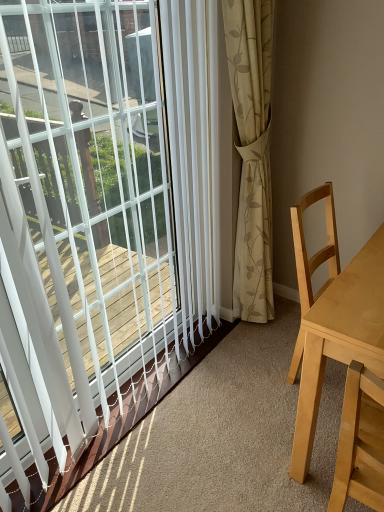
This screenshot has width=384, height=512. What do you see at coordinates (340, 339) in the screenshot?
I see `light wood table at right` at bounding box center [340, 339].

At what (x,y) coordinates should I click in order to perform the action: click on light wood table at right. Please return your answer as a coordinate pair (x, y). Looking at the image, I should click on (340, 339).

Describe the element at coordinates (101, 207) in the screenshot. I see `white plastic blinds at upper left` at that location.

This screenshot has width=384, height=512. Identify the location of white plastic blinds at upper left. (101, 207).

In order to face white plastic blinds at upper left, should I rotate leftwards or rightwards?

Rotate your view left by about 10.542°.

At what (x,y) coordinates should I click in order to perform the action: click on light wood table at right. Please return your answer as a coordinate pair (x, y). The height and width of the screenshot is (512, 384). Looking at the image, I should click on (340, 339).

Is light wood table at right to the left or to the right of white plastic blinds at upper left in the image?

From the image, it's evident that light wood table at right is to the right of white plastic blinds at upper left.

In the image, is light wood table at right positioned in front of or behind white plastic blinds at upper left?

Clearly, light wood table at right is behind white plastic blinds at upper left.

Which is behind, point (299, 393) or point (92, 322)?

Positioned behind is point (92, 322).

From the image's perspective, is light wood table at right below white plastic blinds at upper left?

Yes.

From a real-world perspective, is light wood table at right above or below white plastic blinds at upper left?

light wood table at right is situated lower than white plastic blinds at upper left in the real world.

Which object is wider, light wood table at right or white plastic blinds at upper left?

With larger width is light wood table at right.

From their relative heights in the image, would you say light wood table at right is taller or shorter than white plastic blinds at upper left?

Considering their sizes, light wood table at right has less height than white plastic blinds at upper left.

In the scene shown: Who is bigger, light wood table at right or white plastic blinds at upper left?

light wood table at right is bigger.

Would you say light wood table at right is inside or outside white plastic blinds at upper left?

The correct answer is: outside.

Is light wood table at right with white plastic blinds at upper left?

No, light wood table at right is not with white plastic blinds at upper left.

Is light wood table at right oriented away from white plastic blinds at upper left?

No, light wood table at right is not facing away from white plastic blinds at upper left.

Can you tell me how much light wood table at right and white plastic blinds at upper left differ in facing direction?

91.7 degrees.

You are a GUI agent. You are given a task and a screenshot of the screen. Output one action in this format:
    pyautogui.click(x=<x>, y=<y>)
    Task: Click on the window to the left of light wood table at right
    The image size is (384, 512).
    Given the screenshot: What is the action you would take?
    pyautogui.click(x=101, y=207)

Which is more to the right, white plastic blinds at upper left or light wood table at right?

light wood table at right is more to the right.

Considering the relative positions of white plastic blinds at upper left and light wood table at right in the image provided, is white plastic blinds at upper left behind light wood table at right?

No, white plastic blinds at upper left is closer to the viewer.

Which point is more distant from viewer, (x=61, y=176) or (x=366, y=316)?

Point (x=61, y=176)

From the image's perspective, who appears lower, white plastic blinds at upper left or light wood table at right?

light wood table at right.

From a real-world perspective, is white plastic blinds at upper left under light wood table at right?

No, from a real-world perspective, white plastic blinds at upper left is not below light wood table at right.

Considering the relative sizes of white plastic blinds at upper left and light wood table at right in the image provided, is white plastic blinds at upper left thinner than light wood table at right?

Correct, the width of white plastic blinds at upper left is less than that of light wood table at right.

Which of these two, white plastic blinds at upper left or light wood table at right, stands shorter?

With less height is light wood table at right.

Who is bigger, white plastic blinds at upper left or light wood table at right?

light wood table at right is bigger.

Is white plastic blinds at upper left outside of light wood table at right?

That's correct, white plastic blinds at upper left is outside of light wood table at right.

Are white plastic blinds at upper left and light wood table at right making contact?

There is a gap between white plastic blinds at upper left and light wood table at right.

Is white plastic blinds at upper left aimed at light wood table at right?

Yes, white plastic blinds at upper left is turned towards light wood table at right.

Identify the location of window positioned vertically above the light wood table at right (from a real-world perspective). This screenshot has height=512, width=384. (101, 207).

Where is `window that is on the left side of light wood table at right`? window that is on the left side of light wood table at right is located at coordinates (101, 207).

Where is `table beneath the white plastic blinds at upper left (from a real-world perspective)`? This screenshot has height=512, width=384. table beneath the white plastic blinds at upper left (from a real-world perspective) is located at coordinates (340, 339).